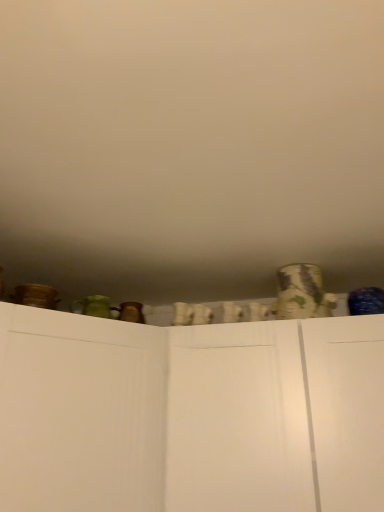
Question: Is white matte cupboard at center facing towards white matte wall at upper center?

Choices:
 (A) yes
 (B) no

Answer: (B)

Question: Would you say white matte cupboard at center is outside white matte wall at upper center?

Choices:
 (A) no
 (B) yes

Answer: (B)

Question: Considering the relative sizes of white matte cupboard at center and white matte wall at upper center in the image provided, is white matte cupboard at center taller than white matte wall at upper center?

Choices:
 (A) yes
 (B) no

Answer: (A)

Question: Considering the relative sizes of white matte cupboard at center and white matte wall at upper center in the image provided, is white matte cupboard at center thinner than white matte wall at upper center?

Choices:
 (A) no
 (B) yes

Answer: (B)

Question: Is white matte cupboard at center closer to the viewer compared to white matte wall at upper center?

Choices:
 (A) no
 (B) yes

Answer: (A)

Question: Can you confirm if white matte cupboard at center is positioned to the right of white matte wall at upper center?

Choices:
 (A) yes
 (B) no

Answer: (A)

Question: Is white matte cupboard at center far away from patterned ceramic vase at upper right?

Choices:
 (A) yes
 (B) no

Answer: (B)

Question: From the image's perspective, is white matte cupboard at center on top of patterned ceramic vase at upper right?

Choices:
 (A) no
 (B) yes

Answer: (A)

Question: From the image's perspective, would you say white matte cupboard at center is shown under patterned ceramic vase at upper right?

Choices:
 (A) yes
 (B) no

Answer: (A)

Question: From a real-world perspective, is white matte cupboard at center below patterned ceramic vase at upper right?

Choices:
 (A) no
 (B) yes

Answer: (B)

Question: Is white matte cupboard at center in front of patterned ceramic vase at upper right?

Choices:
 (A) yes
 (B) no

Answer: (A)

Question: Is white matte cupboard at center bigger than patterned ceramic vase at upper right?

Choices:
 (A) no
 (B) yes

Answer: (B)

Question: Is white matte wall at upper center further to the viewer compared to white matte cupboard at center?

Choices:
 (A) no
 (B) yes

Answer: (A)